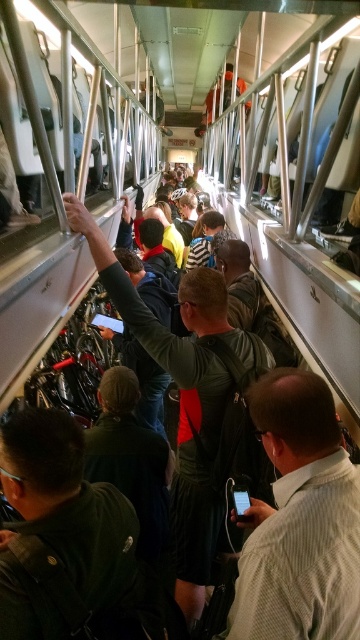
Question: Can you confirm if light brown shirt at center is bigger than dark gray leather jacket at center?

Choices:
 (A) no
 (B) yes

Answer: (A)

Question: Does light brown shirt at center have a greater width compared to dark green jacket at center?

Choices:
 (A) yes
 (B) no

Answer: (A)

Question: Can you confirm if dark green jacket at center is positioned to the right of dark gray leather jacket at center?

Choices:
 (A) yes
 (B) no

Answer: (B)

Question: Which point is farther to the camera?

Choices:
 (A) (298, 630)
 (B) (79, 589)
 (C) (270, 364)

Answer: (C)

Question: Which of the following is the closest to the observer?

Choices:
 (A) light brown shirt at center
 (B) dark gray leather jacket at center

Answer: (A)

Question: Which object appears closest to the camera in this image?

Choices:
 (A) dark green jacket at center
 (B) light brown shirt at center
 (C) dark gray leather jacket at center

Answer: (A)